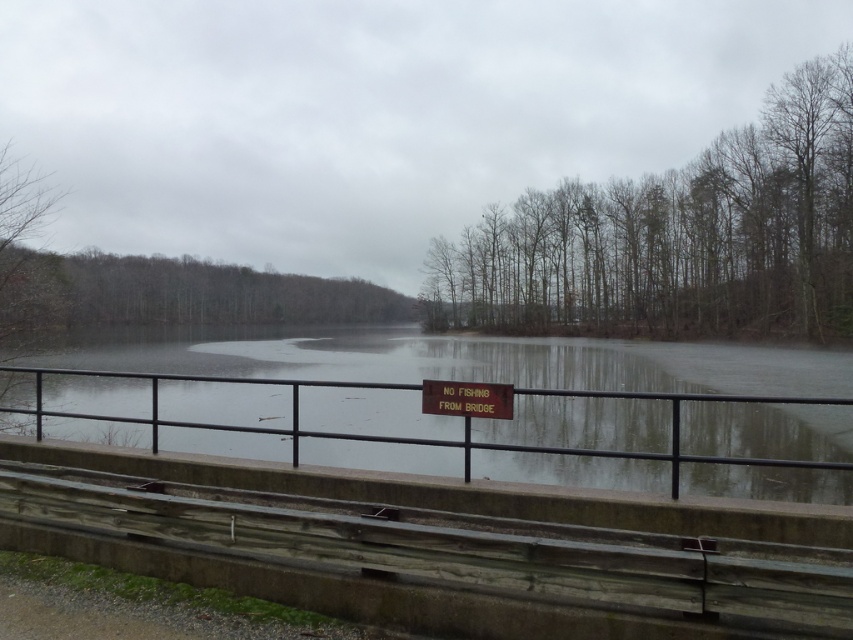
Does smooth concrete river at center have a greater height compared to matte brown sign at center?

Yes, smooth concrete river at center is taller than matte brown sign at center.

Who is taller, smooth concrete river at center or matte brown sign at center?

With more height is smooth concrete river at center.

Who is more distant from viewer, (553, 403) or (468, 381)?

The point (553, 403) is more distant.

Find the location of a particular element. smooth concrete river at center is located at coordinates (490, 362).